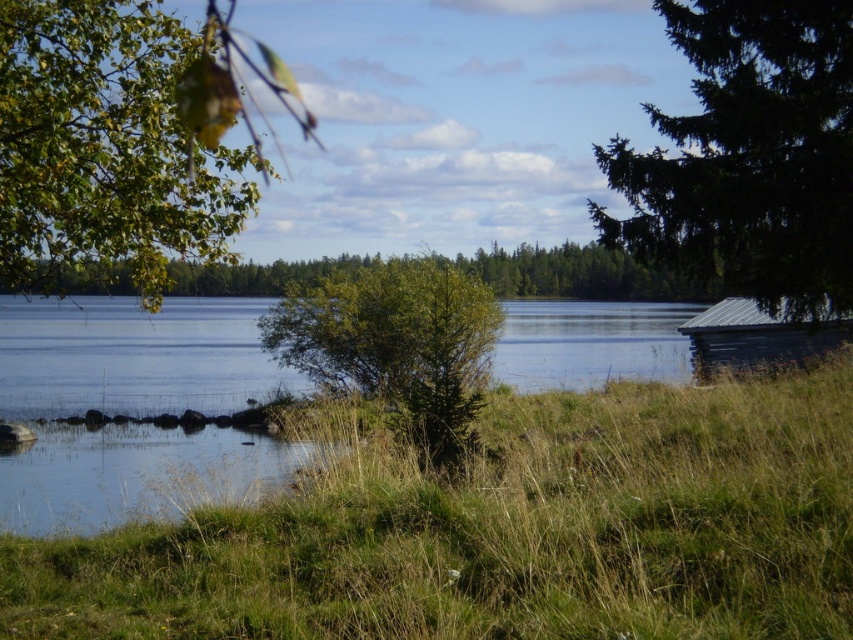
Question: Which of the following is the farthest from the observer?

Choices:
 (A) (144, 301)
 (B) (688, 224)

Answer: (B)

Question: Is green leafy branch at upper left to the right of green leafy tree at center from the viewer's perspective?

Choices:
 (A) no
 (B) yes

Answer: (A)

Question: Which of the following is the farthest from the observer?

Choices:
 (A) green textured pine tree at right
 (B) green leafy branch at upper left
 (C) wooden cabin at right

Answer: (C)

Question: Does green leafy branch at upper left have a greater width compared to green textured pine tree at right?

Choices:
 (A) no
 (B) yes

Answer: (B)

Question: Does green leafy branch at upper left have a lesser width compared to green leafy tree at center?

Choices:
 (A) no
 (B) yes

Answer: (B)

Question: Which object is farther from the camera taking this photo?

Choices:
 (A) green leafy branch at upper left
 (B) green grassy at lower center
 (C) green textured pine tree at right

Answer: (C)